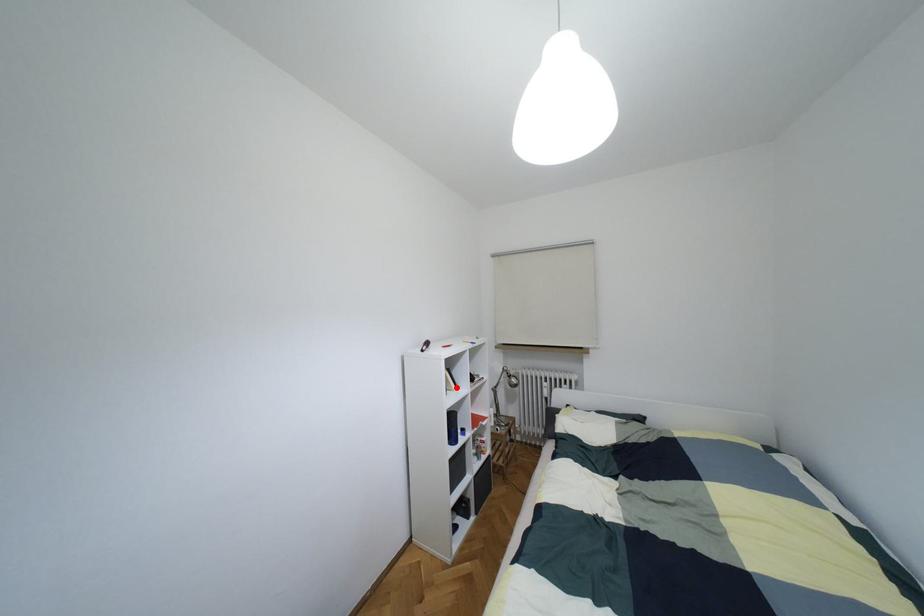
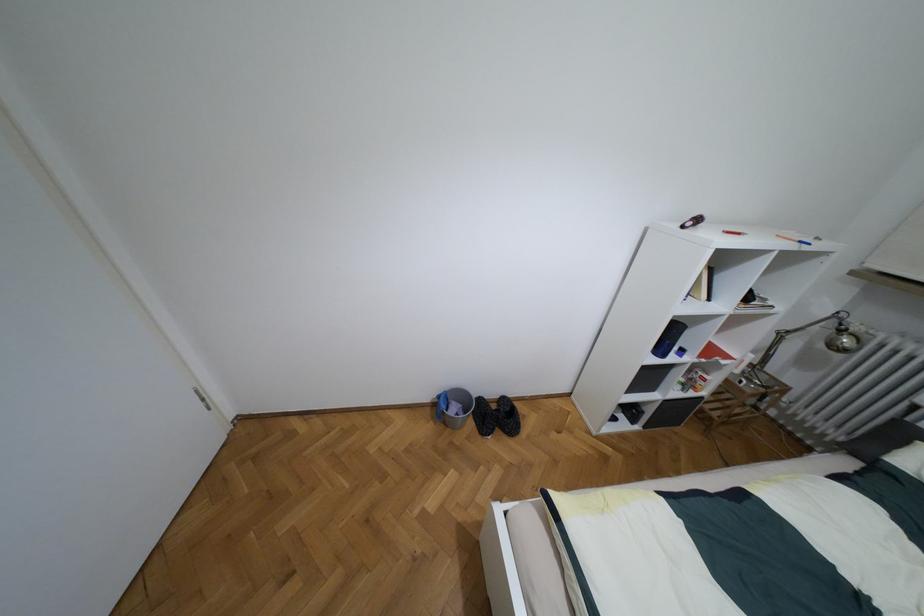
Question: I am providing you with two images of the same scene from different viewpoints. Given a red point in image1, look at the same physical point in image2. Is it:

Choices:
 (A) Closer to the viewpoint
 (B) Farther from the viewpoint

Answer: (A)